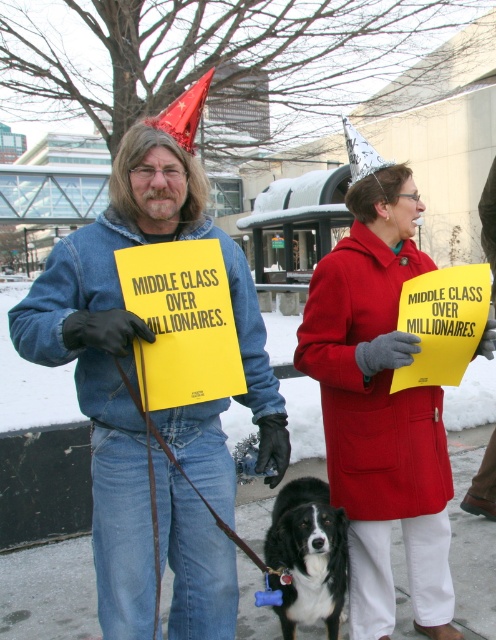
Can you confirm if denim jacket at center is bigger than black fur dog at center?

Indeed, denim jacket at center has a larger size compared to black fur dog at center.

Does denim jacket at center appear under black fur dog at center?

Actually, denim jacket at center is above black fur dog at center.

This screenshot has width=496, height=640. What do you see at coordinates (132, 356) in the screenshot?
I see `denim jacket at center` at bounding box center [132, 356].

Find the location of a particular element. denim jacket at center is located at coordinates (132, 356).

Between point (398, 173) and point (289, 518), which one is positioned behind?

The point (398, 173) is behind.

Locate an element on the screen. matte red coat at center is located at coordinates (380, 410).

Between point (427, 577) and point (336, 580), which one is positioned behind?

The point (427, 577) is more distant.

Where is `matte red coat at center`? The width and height of the screenshot is (496, 640). matte red coat at center is located at coordinates (380, 410).

Consider the image. Is denim jacket at center positioned behind matte red coat at center?

No, it is not.

Consider the image. Between denim jacket at center and matte red coat at center, which one appears on the left side from the viewer's perspective?

Positioned to the left is denim jacket at center.

Image resolution: width=496 pixels, height=640 pixels. What do you see at coordinates (132, 356) in the screenshot?
I see `denim jacket at center` at bounding box center [132, 356].

Where is `denim jacket at center`? This screenshot has height=640, width=496. denim jacket at center is located at coordinates (132, 356).